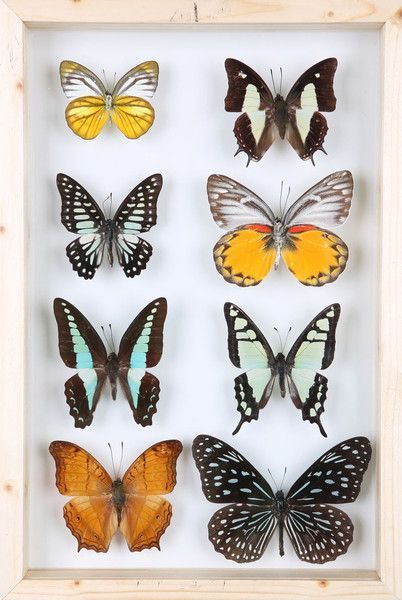
Locate an element on the screen. inner corners of frame is located at coordinates click(x=23, y=576), click(x=382, y=577), click(x=24, y=21), click(x=386, y=21).